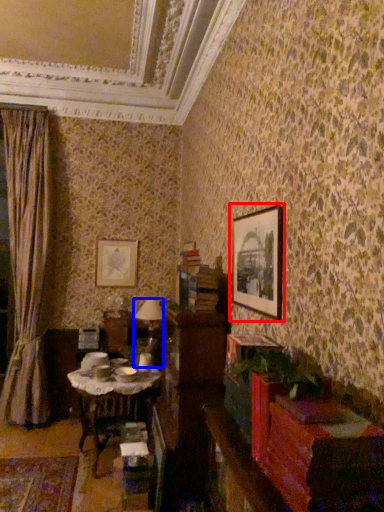
Question: Which of the following is the closest to the observer, picture frame (highlighted by a red box) or table lamp (highlighted by a blue box)?

Choices:
 (A) picture frame
 (B) table lamp

Answer: (A)